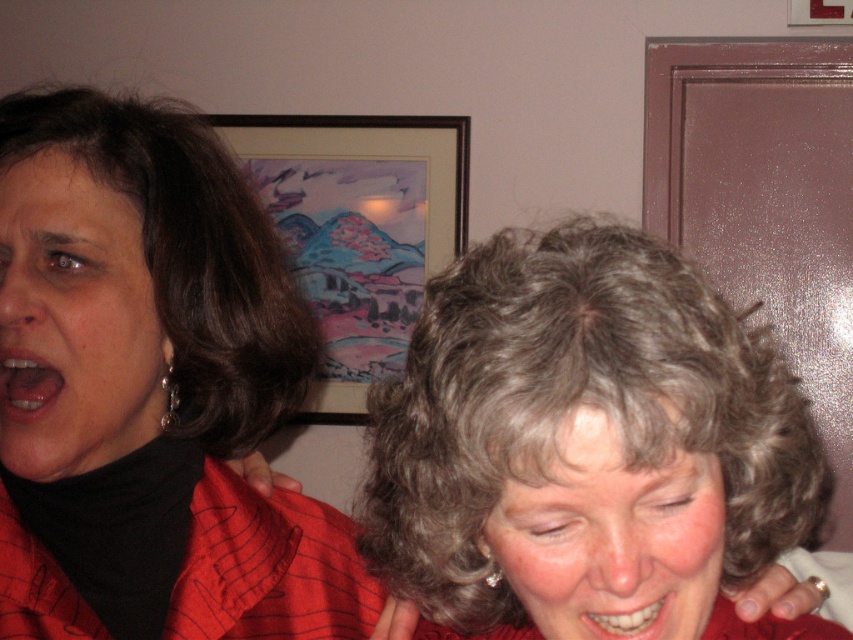
Looking at the scene, which object is positioned to the right of the other between the matte black shirt at left and the matte black face at left?

The matte black shirt at left is to the right of the matte black face at left.

You are a photographer trying to capture a candid shot of the two people in the image. You want to ensure that both the gray curly hair at center and the other person are in focus. Given that your camera has a depth of field that can cover 14 inches, will you be able to achieve this?

The two individuals are 14.61 inches apart. Since the camera can only cover 14 inches, the depth of field is insufficient to keep both the gray curly hair at center and the other person in focus.

You are designing a photo frame that needs to include both the matte black shirt at left and the smooth skin face at center. Based on their widths, which object should you prioritize placing first to ensure both fit properly?

The matte black shirt at left might be wider than the smooth skin face at center, so you should prioritize placing the matte black shirt at left first to accommodate its potential width.